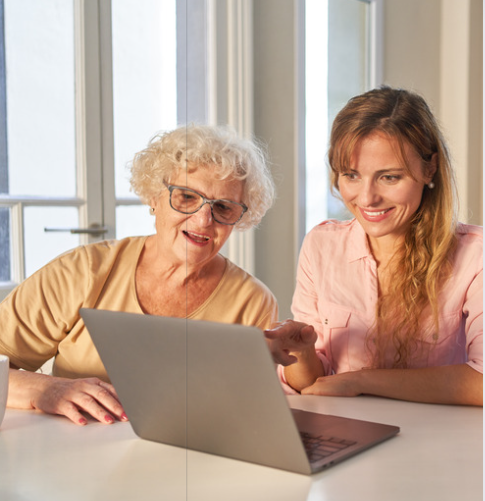
At what (x,y) coordinates should I click in order to perform the action: click on door. Please return your answer as a coordinate pair (x, y). The image size is (485, 501). Looking at the image, I should click on (71, 169), (116, 161).